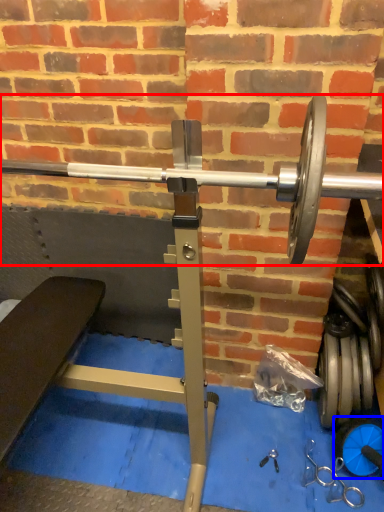
Question: Among these objects, which one is farthest to the camera, barbell (highlighted by a red box) or dumbbell (highlighted by a blue box)?

Choices:
 (A) barbell
 (B) dumbbell

Answer: (B)